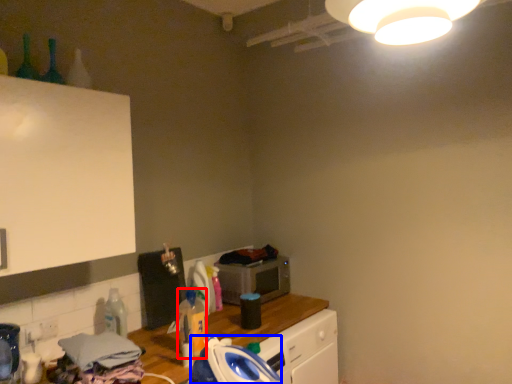
Question: Which object appears closest to the camera in this image, bottle (highlighted by a red box) or appliance (highlighted by a blue box)?

Choices:
 (A) bottle
 (B) appliance

Answer: (B)